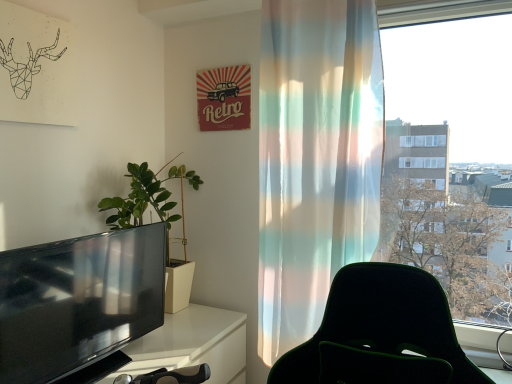
Identify the location of green matte plant at left. This screenshot has height=384, width=512. (160, 219).

The height and width of the screenshot is (384, 512). Describe the element at coordinates (315, 159) in the screenshot. I see `translucent fabric curtain at right` at that location.

Where is `green matte plant at left`? The image size is (512, 384). green matte plant at left is located at coordinates (160, 219).

Considering the relative positions of translucent fabric curtain at right and black glossy television at left in the image provided, is translucent fabric curtain at right behind black glossy television at left?

Yes, it is.

Consider the image. Is translucent fabric curtain at right with black glossy television at left?

translucent fabric curtain at right and black glossy television at left are not in contact.

Does translucent fabric curtain at right have a lesser width compared to black glossy television at left?

In fact, translucent fabric curtain at right might be wider than black glossy television at left.

Is green matte plant at left to the right of translucent fabric curtain at right from the viewer's perspective?

No.

From the image's perspective, is green matte plant at left beneath translucent fabric curtain at right?

Yes, from the image's perspective, green matte plant at left is below translucent fabric curtain at right.

Is green matte plant at left situated inside translucent fabric curtain at right or outside?

green matte plant at left is spatially situated outside translucent fabric curtain at right.

From a real-world perspective, which is physically below, green matte plant at left or translucent fabric curtain at right?

green matte plant at left.

From a real-world perspective, which is physically below, translucent fabric curtain at right or green matte plant at left?

green matte plant at left is physically lower.

Considering the sizes of translucent fabric curtain at right and green matte plant at left in the image, is translucent fabric curtain at right taller or shorter than green matte plant at left?

translucent fabric curtain at right is taller than green matte plant at left.

Is there a large distance between translucent fabric curtain at right and green matte plant at left?

They are positioned close to each other.

Is point (366, 197) positioned behind point (189, 176)?

No, (366, 197) is in front of (189, 176).

Based on the photo, which is less distant, [23,264] or [309,254]?

Point [23,264] appears to be closer to the viewer than point [309,254].

Is black glossy television at left to the right of translucent fabric curtain at right from the viewer's perspective?

In fact, black glossy television at left is to the left of translucent fabric curtain at right.

From a real-world perspective, does black glossy television at left sit lower than translucent fabric curtain at right?

Correct, in the physical world, black glossy television at left is lower than translucent fabric curtain at right.

Is black glossy television at left inside or outside of green matte plant at left?

black glossy television at left cannot be found inside green matte plant at left.

Looking at this image, based on their sizes in the image, would you say black glossy television at left is bigger or smaller than green matte plant at left?

Considering their sizes, black glossy television at left takes up less space than green matte plant at left.

Considering the relative positions of black glossy television at left and green matte plant at left in the image provided, is black glossy television at left to the left or to the right of green matte plant at left?

Based on their positions, black glossy television at left is located to the left of green matte plant at left.

Can you tell me how much black glossy television at left and green matte plant at left differ in facing direction?

There is a 5.52-degree angle between the facing directions of black glossy television at left and green matte plant at left.

From the image's perspective, between green matte plant at left and black glossy television at left, which one is located above?

green matte plant at left appears higher in the image.

Are green matte plant at left and black glossy television at left far apart?

That's not correct — green matte plant at left is a little close to black glossy television at left.

In terms of size, does green matte plant at left appear bigger or smaller than black glossy television at left?

In the image, green matte plant at left appears to be larger than black glossy television at left.

At what (x,y) coordinates should I click in order to perform the action: click on television located on the left of translucent fabric curtain at right. Please return your answer as a coordinate pair (x, y). This screenshot has width=512, height=384. Looking at the image, I should click on (78, 301).

In order to click on curtain above the green matte plant at left (from the image's perspective) in this screenshot , I will do `click(315, 159)`.

When comparing their distances from translucent fabric curtain at right, does black glossy television at left or green matte plant at left seem closer?

black glossy television at left is positioned closer to the anchor translucent fabric curtain at right.

Based on the photo, estimate the real-world distances between objects in this image. Which object is closer to black glossy television at left, translucent fabric curtain at right or green matte plant at left?

Among the two, green matte plant at left is located nearer to black glossy television at left.

Estimate the real-world distances between objects in this image. Which object is further from green matte plant at left, translucent fabric curtain at right or black glossy television at left?

The object further to green matte plant at left is translucent fabric curtain at right.

Looking at the image, which one is located further to green matte plant at left, black glossy television at left or translucent fabric curtain at right?

The object further to green matte plant at left is translucent fabric curtain at right.

Which object lies further to the anchor point translucent fabric curtain at right, green matte plant at left or black glossy television at left?

green matte plant at left lies further to translucent fabric curtain at right than the other object.

When comparing their distances from black glossy television at left, does green matte plant at left or translucent fabric curtain at right seem closer?

green matte plant at left is closer to black glossy television at left.

Identify the location of houseplant located between black glossy television at left and translucent fabric curtain at right in the left-right direction. The width and height of the screenshot is (512, 384). (160, 219).